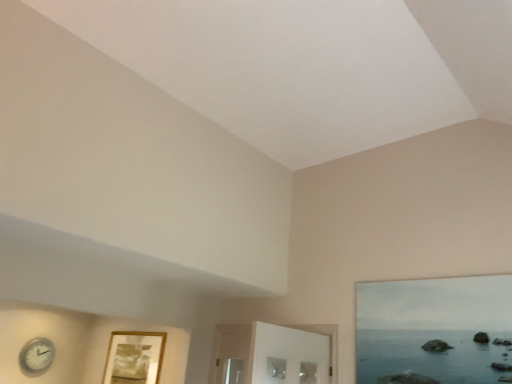
Question: Is point click(x=123, y=339) closer or farther from the camera than point click(x=46, y=360)?

Choices:
 (A) farther
 (B) closer

Answer: (A)

Question: From the image's perspective, is wooden picture frame at lower left located above or below white plastic clock at lower left?

Choices:
 (A) below
 (B) above

Answer: (B)

Question: Considering their positions, is wooden picture frame at lower left located in front of or behind white plastic clock at lower left?

Choices:
 (A) front
 (B) behind

Answer: (A)

Question: Would you say white plastic clock at lower left is inside or outside wooden picture frame at lower left?

Choices:
 (A) outside
 (B) inside

Answer: (A)

Question: Based on their sizes in the image, would you say white plastic clock at lower left is bigger or smaller than wooden picture frame at lower left?

Choices:
 (A) big
 (B) small

Answer: (B)

Question: In the image, is white plastic clock at lower left positioned in front of or behind wooden picture frame at lower left?

Choices:
 (A) behind
 (B) front

Answer: (A)

Question: Is point (27, 365) positioned closer to the camera than point (141, 342)?

Choices:
 (A) farther
 (B) closer

Answer: (B)